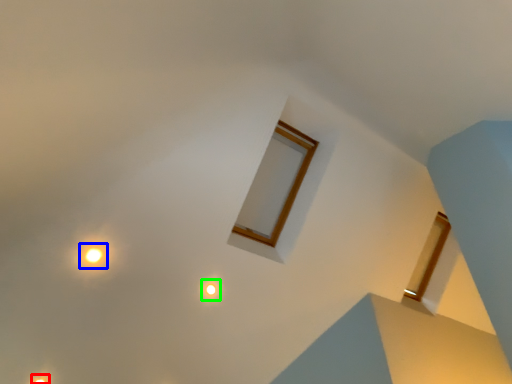
Question: Which object is the closest to the light (highlighted by a red box)? Choose among these: light (highlighted by a blue box) or light (highlighted by a green box).

Choices:
 (A) light
 (B) light

Answer: (A)